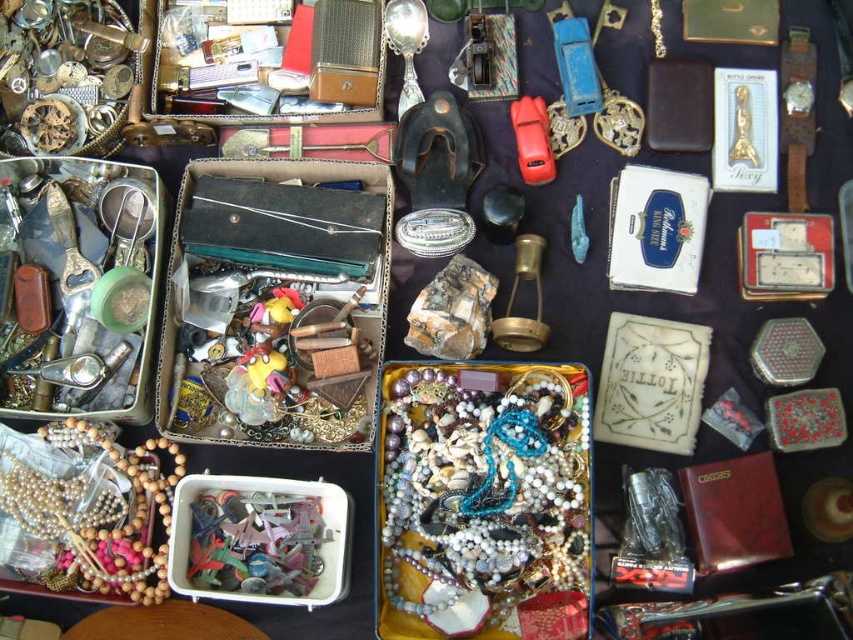
Does gold leather watch at upper right come behind gold metallic lantern at center?

Yes, it is.

Describe the element at coordinates (798, 113) in the screenshot. I see `gold leather watch at upper right` at that location.

The image size is (853, 640). I want to click on gold leather watch at upper right, so click(x=798, y=113).

Is point (167, 483) positioned in front of point (16, 52)?

Yes, point (167, 483) is closer to viewer.

Does wooden beads at lower left appear over gold-toned watch parts at upper left?

Incorrect, wooden beads at lower left is not positioned above gold-toned watch parts at upper left.

Describe the element at coordinates (88, 508) in the screenshot. I see `wooden beads at lower left` at that location.

Locate an element on the screen. Image resolution: width=853 pixels, height=640 pixels. wooden beads at lower left is located at coordinates (88, 508).

Identify the location of gold leather watch at upper right. The image size is (853, 640). [x=798, y=113].

What do you see at coordinates (798, 113) in the screenshot? I see `gold leather watch at upper right` at bounding box center [798, 113].

Is point (785, 99) farther from viewer compared to point (659, 8)?

No.

Where is `gold leather watch at upper right`? gold leather watch at upper right is located at coordinates (798, 113).